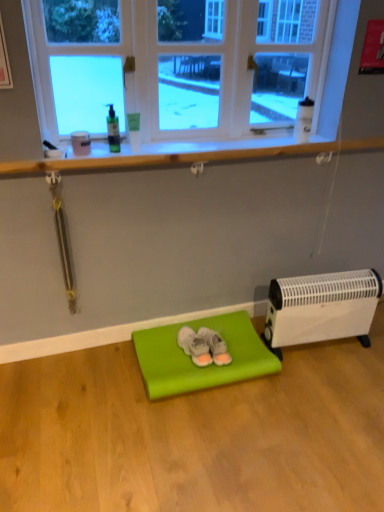
Find the location of `vacant region in front of white suede sneakers at center, which is the 1th footwear in right-to-left order`. vacant region in front of white suede sneakers at center, which is the 1th footwear in right-to-left order is located at coordinates (215, 374).